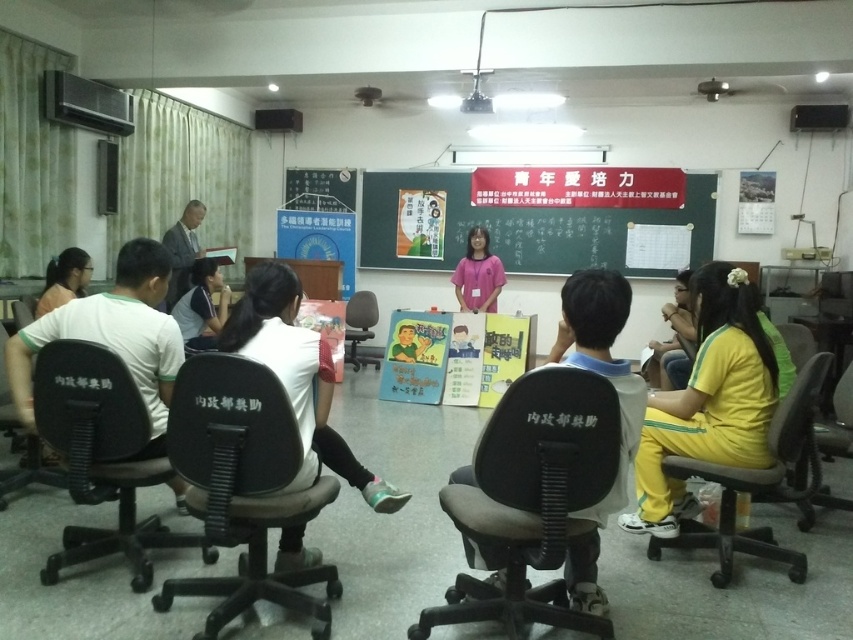
Question: Is white fabric shirt at left below light gray suit at center?

Choices:
 (A) yes
 (B) no

Answer: (A)

Question: Estimate the real-world distances between objects in this image. Which object is closer to the pink fabric shirt at center?

Choices:
 (A) black plastic chair at center
 (B) black plastic chair at left

Answer: (A)

Question: Estimate the real-world distances between objects in this image. Which object is closer to the gray fabric swivel chair at center?

Choices:
 (A) black plastic chair at lower left
 (B) matte black shirt at left
 (C) black plastic chair at center
 (D) black plastic chair at lower right

Answer: (D)

Question: Which point is farther to the camera?

Choices:
 (A) (51, 298)
 (B) (817, 448)

Answer: (A)

Question: Does yellow fabric pants at lower right appear on the right side of matte white shirt at center?

Choices:
 (A) yes
 (B) no

Answer: (A)

Question: Is matte white shirt at center behind black plastic chair at lower left?

Choices:
 (A) yes
 (B) no

Answer: (A)